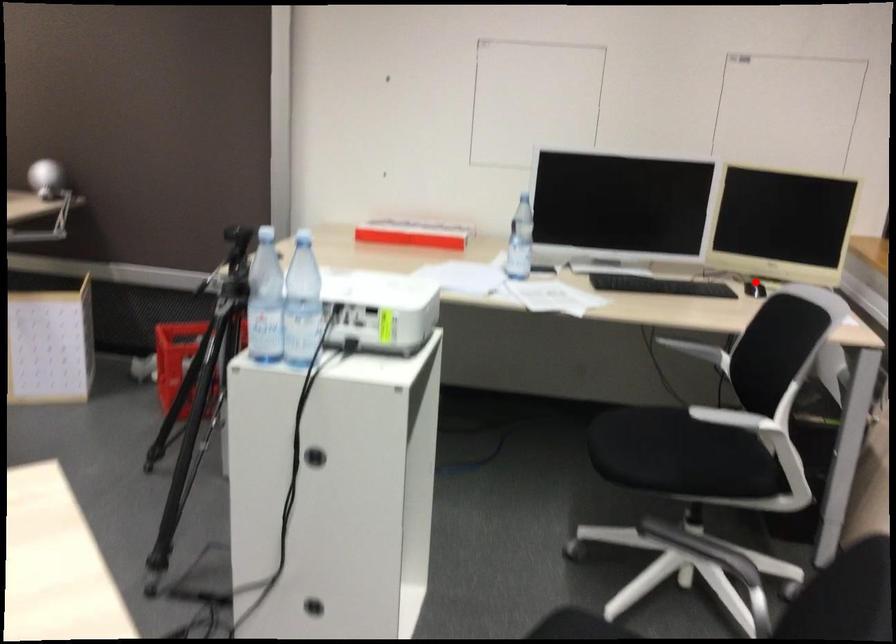
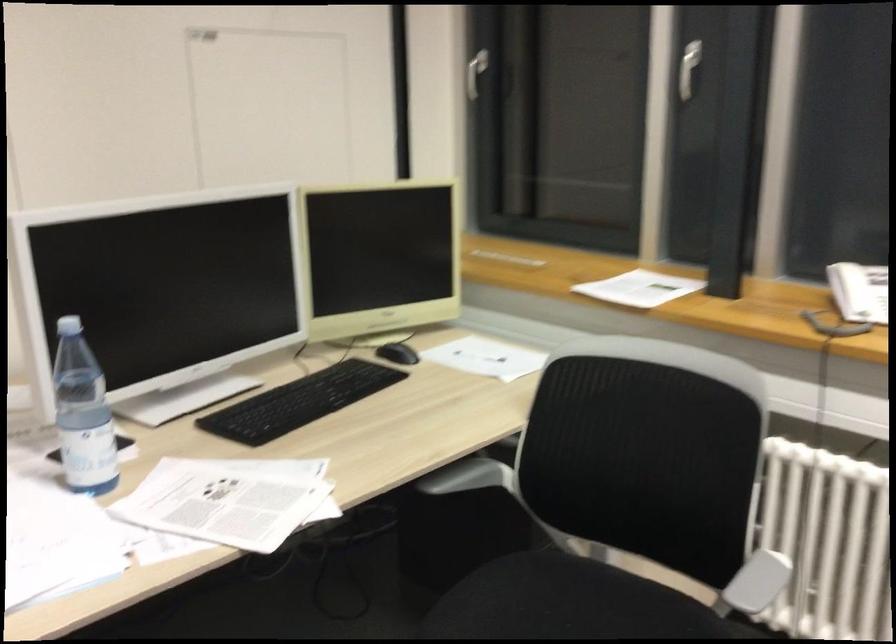
Find the pixel in the second image that matches the highlighted location in the first image.

(398, 353)